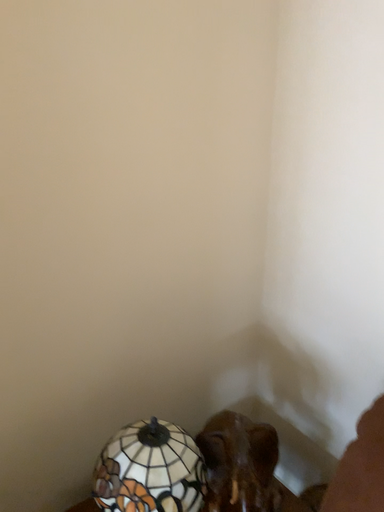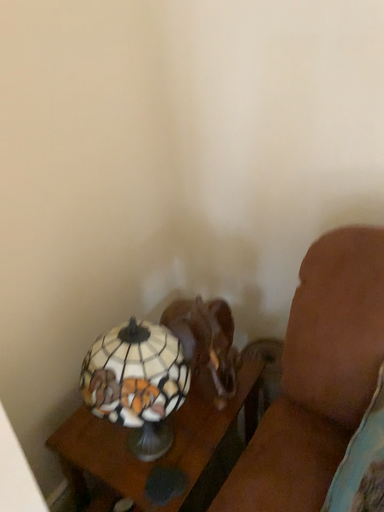
Question: How did the camera likely rotate when shooting the video?

Choices:
 (A) rotated upward
 (B) rotated downward

Answer: (B)